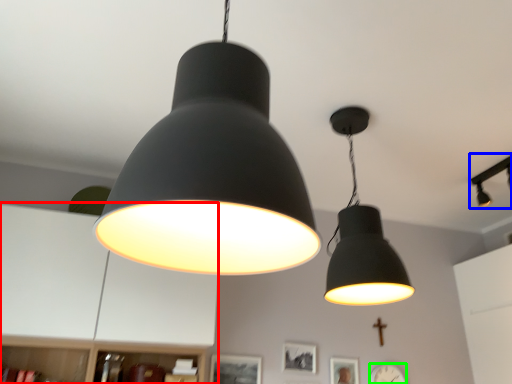
Question: Estimate the real-world distances between objects in this image. Which object is closer to dresser (highlighted by a red box), lamp (highlighted by a blue box) or clock (highlighted by a green box)?

Choices:
 (A) lamp
 (B) clock

Answer: (B)